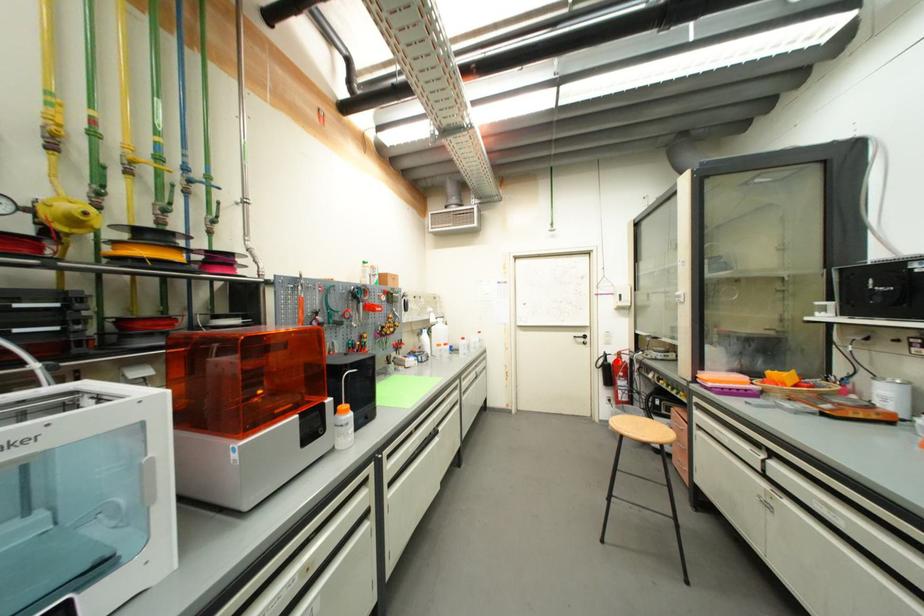
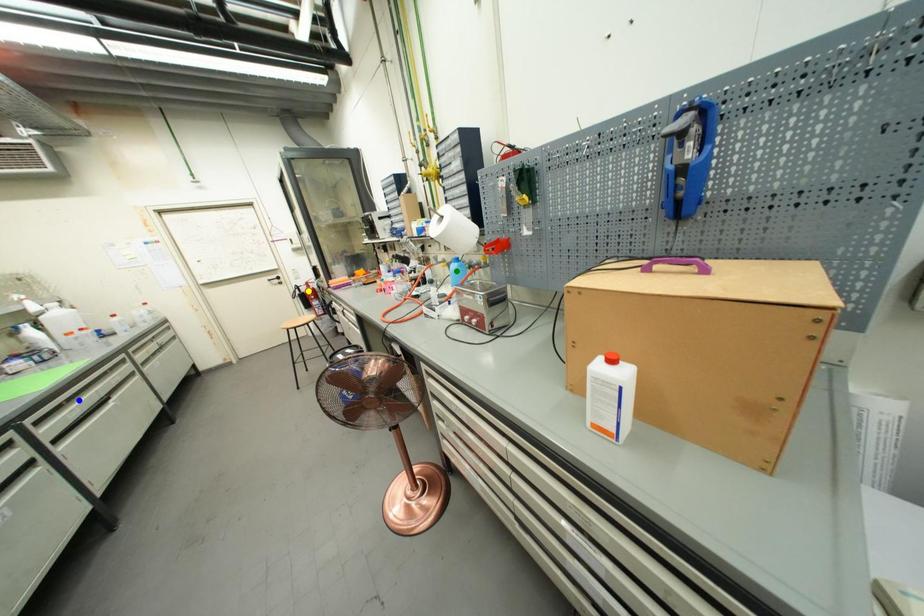
Question: I am providing you with two images of the same scene from different viewpoints. A red point is marked on the first image. You are given multiple points on the second image. Which spot in image 2 lines up with the point in image 1?

Choices:
 (A) green point
 (B) yellow point
 (C) blue point

Answer: (B)